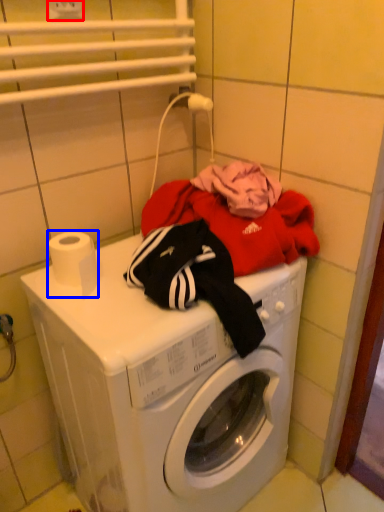
Question: Which object is closer to the camera taking this photo, electric outlet (highlighted by a red box) or toilet paper (highlighted by a blue box)?

Choices:
 (A) electric outlet
 (B) toilet paper

Answer: (B)